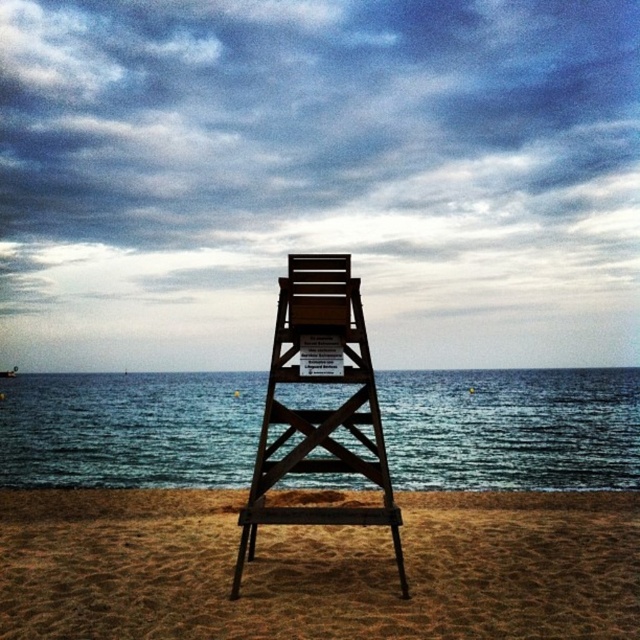
Based on the photo, you are standing on the brown sandy beach at center and want to sit on the wooden lifeguard chair at center. Which direction should you move to reach the chair?

The brown sandy beach at center is positioned on the left side of the wooden lifeguard chair at center, so you should move to the right to reach the chair.